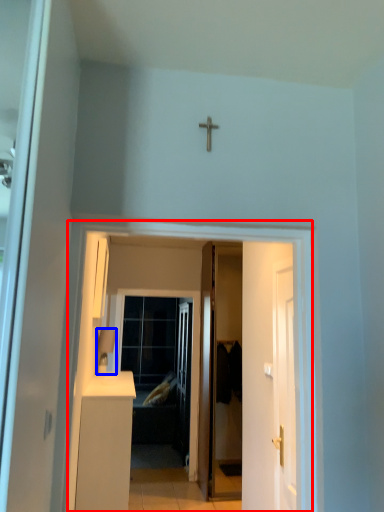
Question: Which of the following is the closest to the observer, corridor (highlighted by a red box) or lamp (highlighted by a blue box)?

Choices:
 (A) corridor
 (B) lamp

Answer: (A)